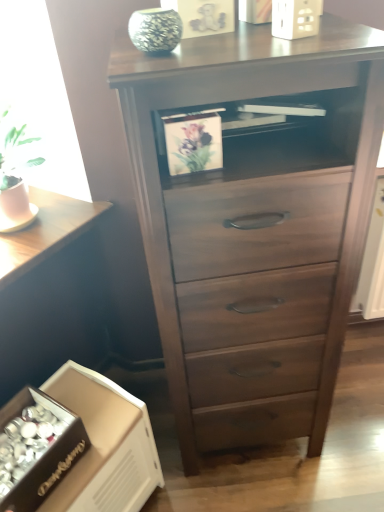
Question: Is dark wood chest of drawers at center wider than dark wood table at lower left?

Choices:
 (A) no
 (B) yes

Answer: (A)

Question: Is dark wood chest of drawers at center in front of dark wood table at lower left?

Choices:
 (A) yes
 (B) no

Answer: (A)

Question: Can you confirm if dark wood chest of drawers at center is bigger than dark wood table at lower left?

Choices:
 (A) yes
 (B) no

Answer: (A)

Question: Could dark wood table at lower left be considered to be inside dark wood chest of drawers at center?

Choices:
 (A) no
 (B) yes

Answer: (A)

Question: Does dark wood chest of drawers at center have a lesser width compared to dark wood table at lower left?

Choices:
 (A) yes
 (B) no

Answer: (A)

Question: Looking at their shapes, would you say dark wood chest of drawers at center is wider or thinner than green textured vase at upper center?

Choices:
 (A) thin
 (B) wide

Answer: (B)

Question: Considering the positions of point (302, 256) and point (150, 13), is point (302, 256) closer or farther from the camera than point (150, 13)?

Choices:
 (A) farther
 (B) closer

Answer: (A)

Question: Considering the positions of dark wood chest of drawers at center and green textured vase at upper center in the image, is dark wood chest of drawers at center taller or shorter than green textured vase at upper center?

Choices:
 (A) tall
 (B) short

Answer: (A)

Question: From a real-world perspective, is dark wood chest of drawers at center physically located above or below green textured vase at upper center?

Choices:
 (A) above
 (B) below

Answer: (B)

Question: Considering the positions of point (94, 478) and point (168, 44), is point (94, 478) closer or farther from the camera than point (168, 44)?

Choices:
 (A) farther
 (B) closer

Answer: (A)

Question: Based on their sizes in the image, would you say white cardboard box at lower left is bigger or smaller than green textured vase at upper center?

Choices:
 (A) big
 (B) small

Answer: (A)

Question: From the image's perspective, is white cardboard box at lower left above or below green textured vase at upper center?

Choices:
 (A) below
 (B) above

Answer: (A)

Question: From a real-world perspective, relative to green textured vase at upper center, is white cardboard box at lower left vertically above or below?

Choices:
 (A) above
 (B) below

Answer: (B)

Question: In terms of height, does dark wood chest of drawers at center look taller or shorter compared to white cardboard box at lower left?

Choices:
 (A) short
 (B) tall

Answer: (B)

Question: Do you think dark wood chest of drawers at center is within white cardboard box at lower left, or outside of it?

Choices:
 (A) inside
 (B) outside

Answer: (B)